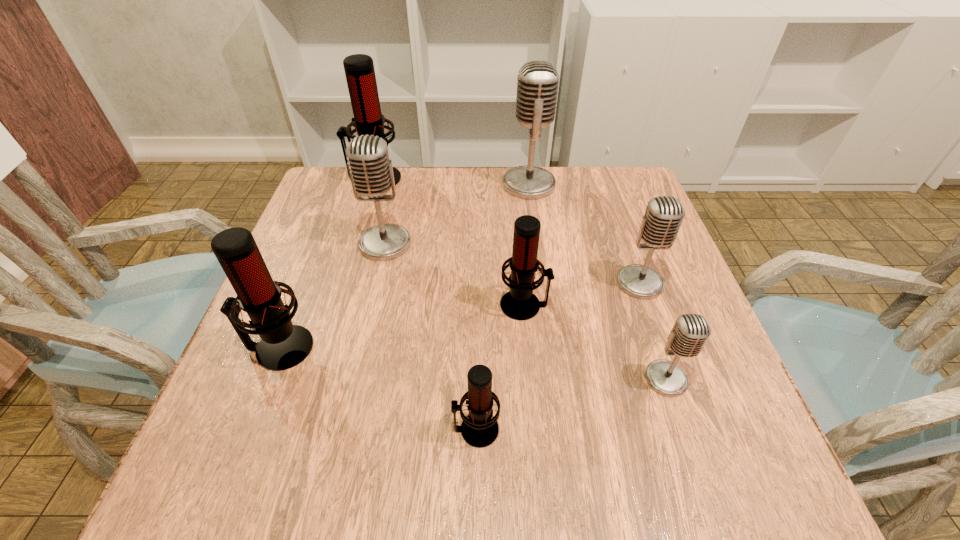
Locate an element on the screen. This screenshot has height=540, width=960. object positioned at the near edge is located at coordinates (479, 429).

Where is `object present at the far left corner`? This screenshot has height=540, width=960. object present at the far left corner is located at coordinates (359, 70).

This screenshot has width=960, height=540. In order to click on vacant region at the far edge in this screenshot , I will do click(x=450, y=186).

This screenshot has height=540, width=960. Find the location of `vacant space at the near edge of the desktop`. vacant space at the near edge of the desktop is located at coordinates [x=315, y=440].

In the image, there is a desktop. Where is `vacant space at the left edge`? This screenshot has height=540, width=960. vacant space at the left edge is located at coordinates pyautogui.click(x=286, y=300).

This screenshot has height=540, width=960. What are the coordinates of `free spot at the right edge of the desktop` in the screenshot? It's located at (664, 321).

Where is `free point at the far right corner`? free point at the far right corner is located at coordinates (619, 186).

Find the location of a particular element. This screenshot has height=540, width=960. free spot between the second nearest red microphone and the third gray microphone from right to left is located at coordinates (404, 266).

Where is `free space between the third smallest red microphone and the third red microphone from left to right`? The width and height of the screenshot is (960, 540). free space between the third smallest red microphone and the third red microphone from left to right is located at coordinates (377, 389).

Where is `unoccupied position between the fourth microphone from left to right and the third biggest red microphone`? The height and width of the screenshot is (540, 960). unoccupied position between the fourth microphone from left to right and the third biggest red microphone is located at coordinates (500, 367).